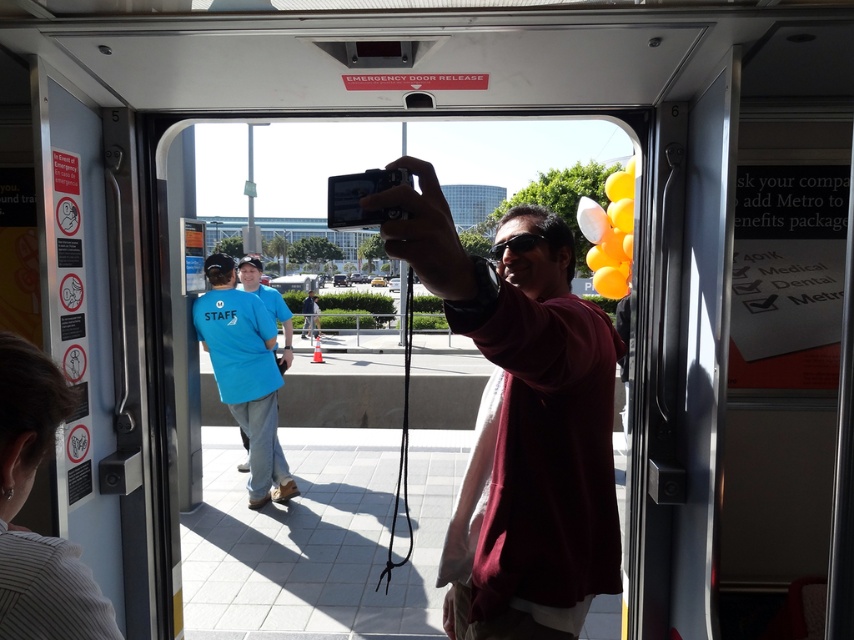
You are a passenger on the train and want to take a photo of the scenery outside through the transparent glass door at center using the black plastic camera at center. Can the camera fit vertically in the frame of the door?

The transparent glass door at center is much taller than the black plastic camera at center, so yes, the camera can fit vertically within the door frame.

You are a photographer trying to decide which camera to use for a quick photo. The matte black camera at center and the black plastic camera at center are both available. Which one is on the right side?

The matte black camera at center is positioned on the right side of the black plastic camera at center, so it is the one on the right.

You are the man taking a selfie with the black plastic camera at center. You want to show the transparent glass door at center in your photo. Should you move your camera to the left or right?

The transparent glass door at center is to the right of the black plastic camera at center, so you should move your camera to the right to include the transparent glass door at center in your photo.